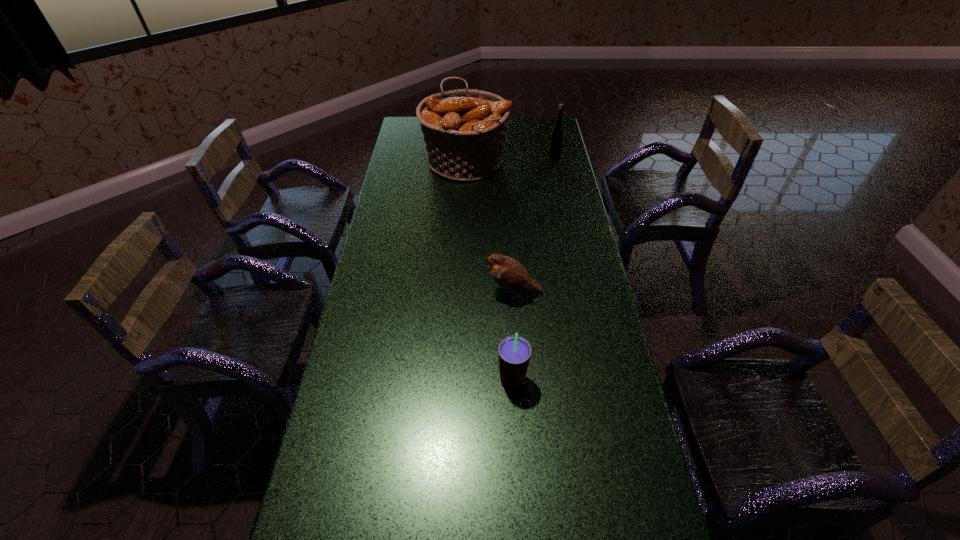
At what (x,y) coordinates should I click in order to perform the action: click on basket. Please return your answer as a coordinate pair (x, y). Image resolution: width=960 pixels, height=540 pixels. Looking at the image, I should click on (464, 130).

Identify the location of beer bottle. (557, 134).

You are a GUI agent. You are given a task and a screenshot of the screen. Output one action in this format:
    pyautogui.click(x=<x>, y=<y>)
    Task: Click on the second tallest object
    This screenshot has width=960, height=540.
    Given the screenshot: What is the action you would take?
    pyautogui.click(x=557, y=134)

Where is `smoothie`? The height and width of the screenshot is (540, 960). smoothie is located at coordinates (514, 351).

The height and width of the screenshot is (540, 960). I want to click on the second shortest object, so click(x=514, y=351).

At what (x,y) coordinates should I click in order to perform the action: click on the second nearest object. Please return your answer as a coordinate pair (x, y). Looking at the image, I should click on (506, 272).

Where is `the shortest object`? the shortest object is located at coordinates (506, 272).

This screenshot has height=540, width=960. I want to click on vacant space located on the left of the tallest object, so point(394,161).

This screenshot has width=960, height=540. I want to click on vacant region located 0.190m on the front of the beer bottle, so click(x=561, y=185).

This screenshot has width=960, height=540. Find the location of `free region located 0.150m on the left of the nearest object`. free region located 0.150m on the left of the nearest object is located at coordinates (444, 379).